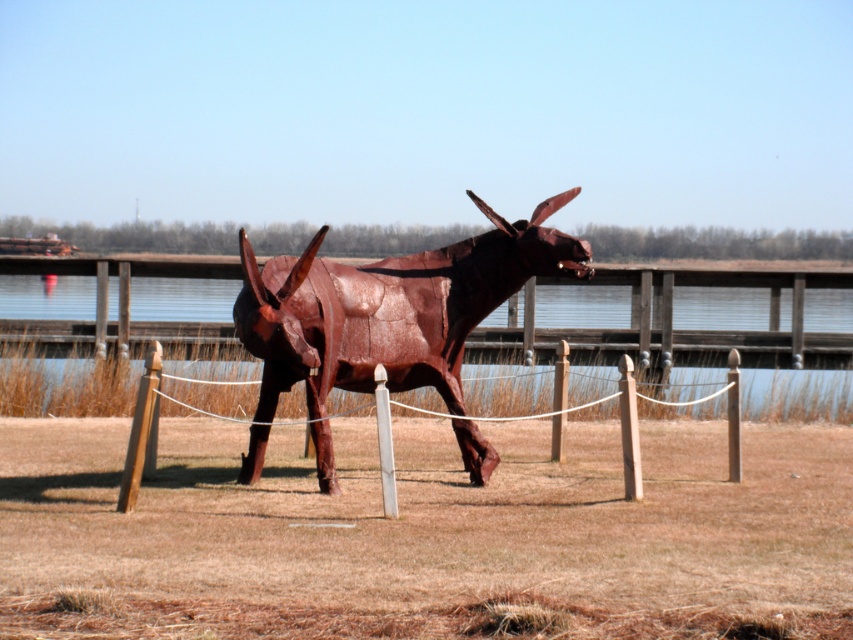
You are standing in a park and see the rusty metal bull at center and the wooden post at center. Which object is larger in size?

The wooden post at center is larger in size than the rusty metal bull at center.

You are standing in front of the sculpture and want to touch the wooden post at center behind the rusty metal bull at center. Can you reach it without moving the bull?

The rusty metal bull at center is closer to the viewer than the wooden post at center, so the wooden post at center is behind the bull and cannot be reached without moving the bull.

You are a visitor at an outdoor art exhibit and want to take a photo of the rusty metal bull at center and the wooden post at center together in the frame. Which object should you focus on first to ensure both are in the shot?

You should focus on the rusty metal bull at center first because it is taller than the wooden post at center, so positioning the camera to include its full height will naturally include the shorter wooden post in the frame as well.